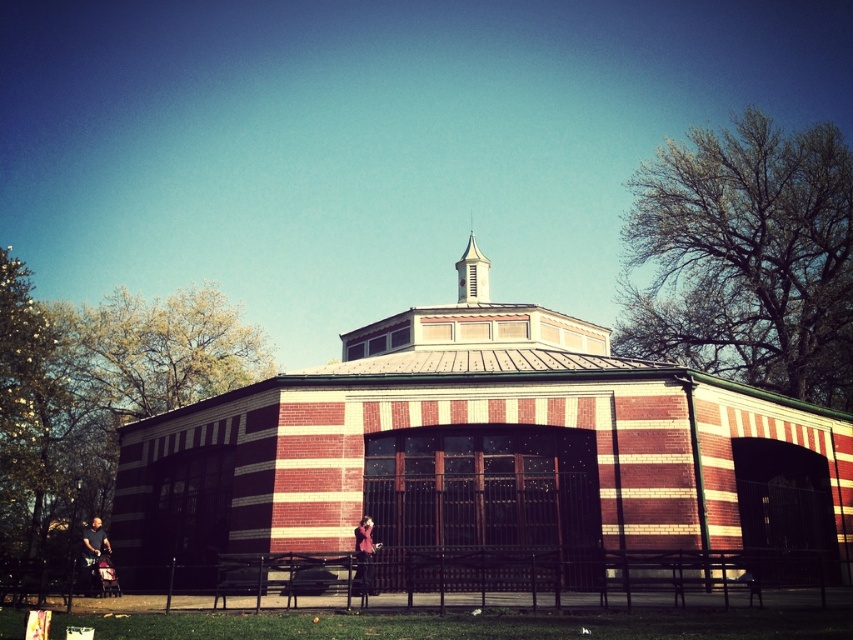
Between black metal picnic table at center and white stucco spire at upper center, which one appears on the left side from the viewer's perspective?

From the viewer's perspective, black metal picnic table at center appears more on the left side.

Does black metal picnic table at center come behind white stucco spire at upper center?

No.

Does point (358, 577) come farther from viewer compared to point (474, 257)?

No, it is in front of (474, 257).

This screenshot has width=853, height=640. Identify the location of black metal picnic table at center. (288, 576).

Is red brick church at center further to camera compared to black metal picnic table at center?

No, it is not.

Does point (349, 529) lie behind point (228, 572)?

Yes, it is.

Which is behind, point (157, 486) or point (288, 589)?

The point (157, 486) is behind.

Where is `red brick church at center`? This screenshot has height=640, width=853. red brick church at center is located at coordinates (486, 456).

Does point (669, 493) lie in front of point (476, 294)?

Yes, point (669, 493) is in front of point (476, 294).

Is red brick church at center further to camera compared to white stucco spire at upper center?

No, red brick church at center is in front of white stucco spire at upper center.

Is point (250, 445) closer to viewer compared to point (480, 282)?

Yes.

Where is `red brick church at center`? This screenshot has height=640, width=853. red brick church at center is located at coordinates (486, 456).